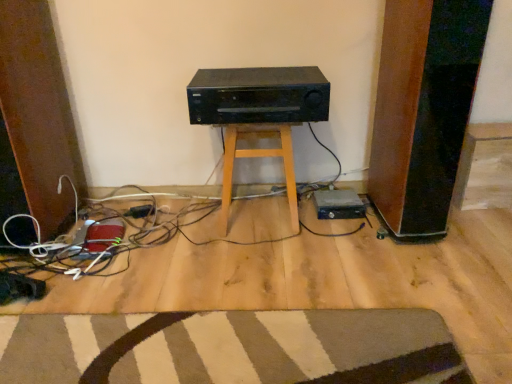
The width and height of the screenshot is (512, 384). Identify the location of black plastic hard drive at lower right. (338, 204).

Image resolution: width=512 pixels, height=384 pixels. In order to click on wooden stool at center in this screenshot , I will do `click(258, 157)`.

This screenshot has width=512, height=384. What do you see at coordinates (258, 157) in the screenshot? I see `wooden stool at center` at bounding box center [258, 157].

At what (x,y) coordinates should I click in order to perform the action: click on black plastic hard drive at lower right. Please return your answer as a coordinate pair (x, y). This screenshot has height=384, width=512. Looking at the image, I should click on (338, 204).

Does point (294, 205) lie in front of point (65, 322)?

No, it is not.

From the picture: Is wooden stool at center not close to striped carpet at lower center?

They are positioned close to each other.

Looking at this image, does wooden stool at center have a greater height compared to black plastic hard drive at lower right?

Correct, wooden stool at center is much taller as black plastic hard drive at lower right.

Considering the sizes of objects wooden stool at center and black plastic hard drive at lower right in the image provided, who is bigger, wooden stool at center or black plastic hard drive at lower right?

wooden stool at center.

From the image's perspective, which object appears higher, wooden stool at center or black plastic hard drive at lower right?

wooden stool at center.

Between point (196, 82) and point (351, 197), which one is positioned behind?

Positioned behind is point (351, 197).

Looking at this image, is the depth of black matte stereo at center less than that of black plastic hard drive at lower right?

Yes.

Is black matte stereo at center positioned beyond the bounds of black plastic hard drive at lower right?

Indeed, black matte stereo at center is completely outside black plastic hard drive at lower right.

From the image's perspective, which one is positioned higher, black matte stereo at center or black plastic plug at lower center?

black matte stereo at center is shown above in the image.

Which object is wider, black matte stereo at center or black plastic plug at lower center?

With larger width is black matte stereo at center.

Which is more to the right, black matte stereo at center or black plastic plug at lower center?

Positioned to the right is black matte stereo at center.

What are the coordinates of `stereo that appears on the right of black plastic plug at lower center` in the screenshot? It's located at (258, 95).

Is there a large distance between wooden stool at center and black matte stereo at center?

No, there isn't a large distance between wooden stool at center and black matte stereo at center.

Locate an element on the screen. This screenshot has height=384, width=512. stereo in front of the wooden stool at center is located at coordinates (258, 95).

Between point (230, 173) and point (226, 86), which one is positioned behind?

The point (230, 173) is more distant.

Between wooden stool at center and black matte stereo at center, which one has larger size?

Bigger between the two is wooden stool at center.

Considering the sizes of objects black plastic plug at lower center and wooden stool at center in the image provided, who is wider, black plastic plug at lower center or wooden stool at center?

With larger width is wooden stool at center.

How many degrees apart are the facing directions of black plastic plug at lower center and wooden stool at center?

black plastic plug at lower center and wooden stool at center are facing 27.8 degrees away from each other.

Identify the location of plug on the left of the wooden stool at center. Image resolution: width=512 pixels, height=384 pixels. (141, 211).

Is black plastic hard drive at lower right not close to striped carpet at lower center?

black plastic hard drive at lower right is actually quite close to striped carpet at lower center.

Does point (321, 210) come in front of point (424, 380)?

No, it is behind (424, 380).

Which is more to the left, black plastic hard drive at lower right or striped carpet at lower center?

Positioned to the left is striped carpet at lower center.

Can striped carpet at lower center be found inside black plastic hard drive at lower right?

No, striped carpet at lower center is located outside of black plastic hard drive at lower right.

I want to click on stool located above the striped carpet at lower center (from a real-world perspective), so click(258, 157).

This screenshot has width=512, height=384. Identify the location of appliance behind the wooden stool at center. (338, 204).

Looking at the image, which one is located further to black plastic plug at lower center, black plastic hard drive at lower right or wooden stool at center?

black plastic hard drive at lower right is positioned further to the anchor black plastic plug at lower center.

In the scene shown: Which object lies nearer to the anchor point wooden stool at center, black plastic plug at lower center or black matte stereo at center?

black matte stereo at center lies closer to wooden stool at center than the other object.

Looking at the image, which one is located further to black plastic plug at lower center, black plastic hard drive at lower right or striped carpet at lower center?

striped carpet at lower center.

Estimate the real-world distances between objects in this image. Which object is closer to black matte stereo at center, black plastic plug at lower center or wooden stool at center?

wooden stool at center is closer to black matte stereo at center.

Which object lies further to the anchor point striped carpet at lower center, wooden stool at center or black plastic plug at lower center?

The object further to striped carpet at lower center is black plastic plug at lower center.

Based on their spatial positions, is striped carpet at lower center or wooden stool at center closer to black plastic hard drive at lower right?

wooden stool at center lies closer to black plastic hard drive at lower right than the other object.

Based on their spatial positions, is striped carpet at lower center or black plastic hard drive at lower right closer to black plastic plug at lower center?

black plastic hard drive at lower right is closer to black plastic plug at lower center.

Looking at this image, from the image, which object appears to be farther from black plastic plug at lower center, wooden stool at center or black plastic hard drive at lower right?

Among the two, black plastic hard drive at lower right is located further to black plastic plug at lower center.

What are the coordinates of `stool between striped carpet at lower center and black plastic hard drive at lower right in the front-back direction` in the screenshot? It's located at (258, 157).

The image size is (512, 384). What are the coordinates of `stool between black matte stereo at center and black plastic hard drive at lower right from top to bottom` in the screenshot? It's located at (258, 157).

I want to click on doormat between black plastic plug at lower center and black plastic hard drive at lower right, so click(232, 348).

Locate an element on the screen. This screenshot has width=512, height=384. plug between black matte stereo at center and striped carpet at lower center in the vertical direction is located at coordinates (141, 211).